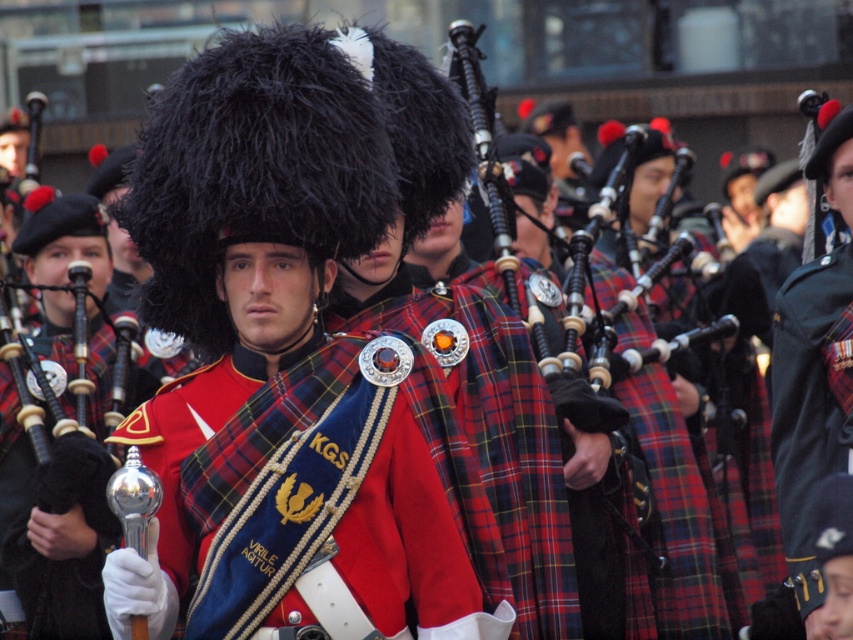
Question: From the image, what is the correct spatial relationship of red plaid sash at center in relation to green fabric uniform at center?

Choices:
 (A) left
 (B) right

Answer: (A)

Question: Is red plaid sash at center positioned before wooden bagpipe at center?

Choices:
 (A) yes
 (B) no

Answer: (A)

Question: Considering the real-world distances, which object is closest to the wooden bagpipe at center?

Choices:
 (A) green fabric uniform at center
 (B) red plaid sash at center

Answer: (A)

Question: Among these objects, which one is nearest to the camera?

Choices:
 (A) red plaid sash at center
 (B) wooden bagpipe at center
 (C) green fabric uniform at center

Answer: (A)

Question: Which object is the farthest from the red plaid sash at center?

Choices:
 (A) green fabric uniform at center
 (B) wooden bagpipe at center

Answer: (A)

Question: Is green fabric uniform at center to the left of wooden bagpipe at center from the viewer's perspective?

Choices:
 (A) no
 (B) yes

Answer: (A)